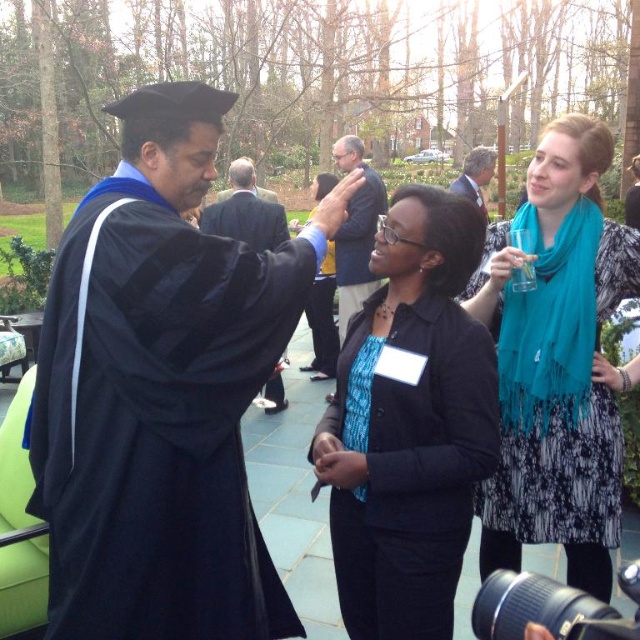
You are a photographer at the graduation event. You need to capture a photo where both the matte black graduation gown at left and the black matte blazer at center are visible. Which object should be placed closer to the camera to ensure both are fully visible in the frame?

The matte black graduation gown at left is taller than the black matte blazer at center. To ensure both are fully visible in the frame, the taller object, the matte black graduation gown at left, should be placed closer to the camera so that the photographer can adjust the angle to include the full height of both objects without cropping either.

You are organizing a photo shoot and need to place two props on a table. The matte black graduation gown at left and the black matte blazer at center must be arranged so that the wider item is on the right side of the table. Which item should you place on the right?

The matte black graduation gown at left should be placed on the right side of the table because it might be wider than the black matte blazer at center.